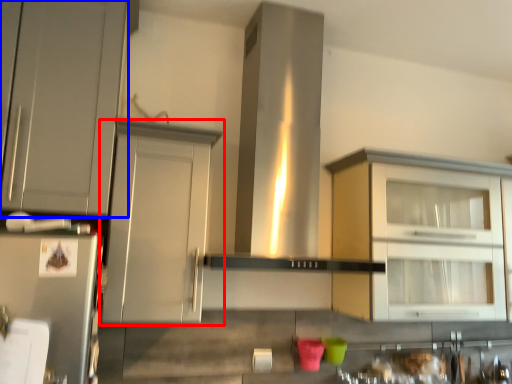
Question: Which of the following is the farthest to the observer, cabinetry (highlighted by a red box) or cabinetry (highlighted by a blue box)?

Choices:
 (A) cabinetry
 (B) cabinetry

Answer: (A)